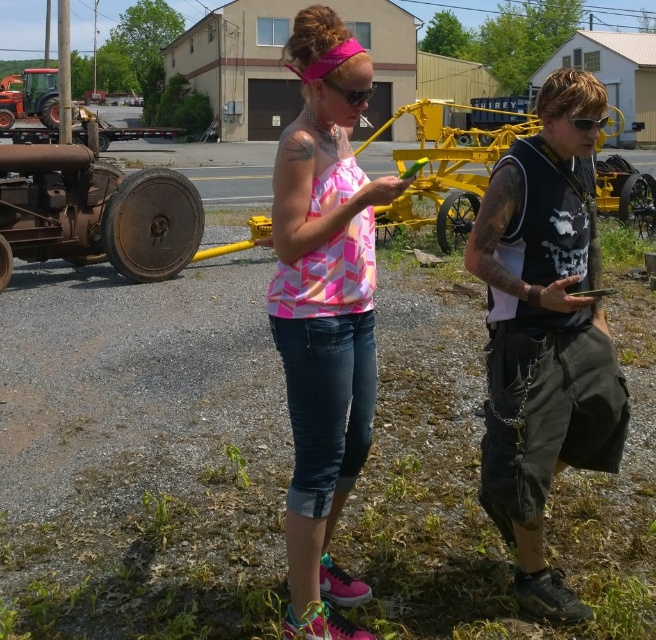
Is point (310, 412) in front of point (592, 120)?

Yes, it is.

Who is higher up, pink printed tank top at center or black plastic goggles at center?

Positioned higher is black plastic goggles at center.

Is point (350, 308) less distant than point (581, 128)?

Yes, it is.

This screenshot has width=656, height=640. I want to click on pink printed tank top at center, so click(323, 314).

Can you confirm if pink rubber goggles at center is shorter than black plastic goggles at center?

No.

Find the location of a particular element. Image resolution: width=656 pixels, height=640 pixels. pink rubber goggles at center is located at coordinates (350, 92).

The image size is (656, 640). Identify the location of pink rubber goggles at center. (350, 92).

Is point (531, 179) positioned after point (577, 129)?

Yes, it is.

Is dark gray cargo pants at center wider than black plastic goggles at center?

Yes, dark gray cargo pants at center is wider than black plastic goggles at center.

Who is more forward, (539, 492) or (583, 122)?

Point (583, 122)

At what (x,y) coordinates should I click in order to perform the action: click on dark gray cargo pants at center. Please return your answer as a coordinate pair (x, y). The width and height of the screenshot is (656, 640). Looking at the image, I should click on (544, 333).